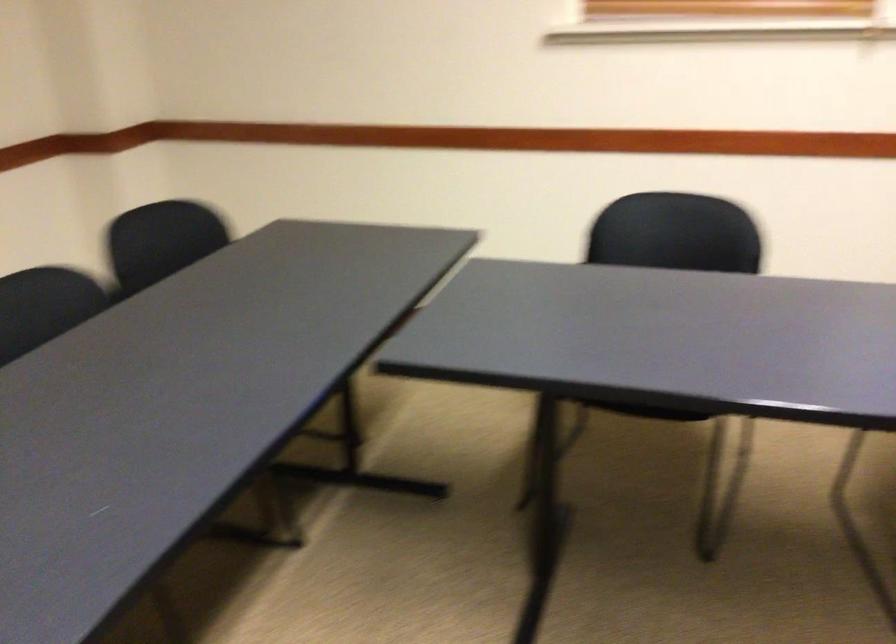
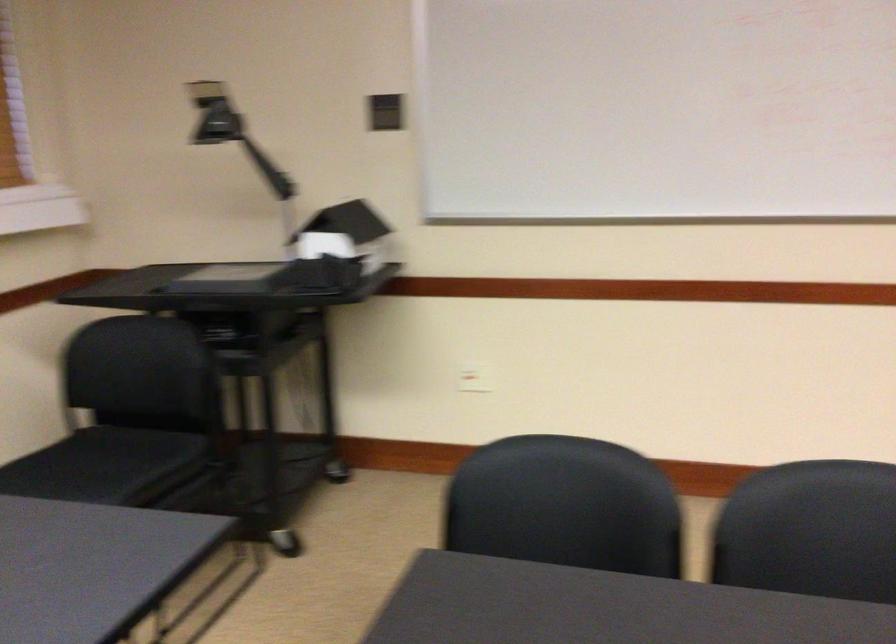
Question: The first image is from the beginning of the video and the second image is from the end. How did the camera likely rotate when shooting the video?

Choices:
 (A) Left
 (B) Right
 (C) Up
 (D) Down

Answer: (B)